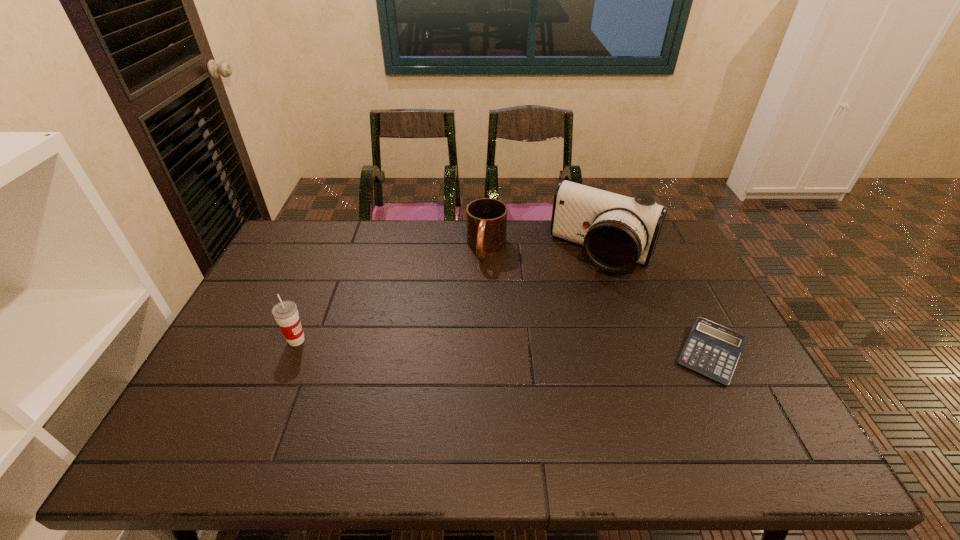
You are a GUI agent. You are given a task and a screenshot of the screen. Output one action in this format:
    pyautogui.click(x=<x>, y=<y>)
    Task: Click on the vacant spot on the desktop that is between the cup and the shortest object and is positioned on the surface of the camcorder
    The height and width of the screenshot is (540, 960).
    Given the screenshot: What is the action you would take?
    pyautogui.click(x=543, y=348)

This screenshot has width=960, height=540. In order to click on free space on the desktop that is between the third shortest object and the shortest object and is positioned on the side of the third object from right to left with the handle in this screenshot , I will do `click(459, 346)`.